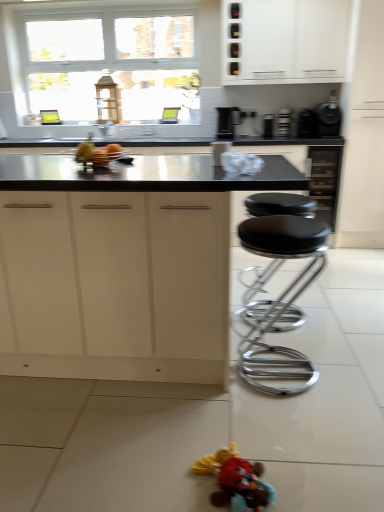
Question: Would you say black chrome stool at center is to the left or to the right of white matte cabinet at upper center, which is counted as the 2th cabinetry, starting from the bottom, in the picture?

Choices:
 (A) left
 (B) right

Answer: (A)

Question: From their relative heights in the image, would you say black chrome stool at center is taller or shorter than white matte cabinet at upper center, the 2th cabinetry positioned from the front?

Choices:
 (A) short
 (B) tall

Answer: (B)

Question: Based on their relative distances, which object is farther from the black matte coffee maker at upper right, the fifth appliance viewed from the left?

Choices:
 (A) black plastic toaster at upper center, placed as the 2th appliance when sorted from left to right
 (B) plush fabric toy at lower center
 (C) matte white cabinets at center, the second cabinetry when ordered from right to left
 (D) white matte cabinet at upper center, the 2th cabinetry positioned from the front
 (E) black plastic toaster at upper center, which is the 3th appliance in left-to-right order

Answer: (B)

Question: Which object is positioned closest to the black plastic toaster at upper center, which is the 3th appliance in left-to-right order?

Choices:
 (A) black plastic toaster at upper right, which appears as the 2th appliance when viewed from the right
 (B) white matte cabinet at upper center, the first cabinetry in the right-to-left sequence
 (C) metallic silver laptop at center, which is counted as the 5th appliance, starting from the right
 (D) black plastic toaster at upper center, placed as the 2th appliance when sorted from left to right
 (E) matte white cabinets at center, the 1th cabinetry positioned from the front

Answer: (D)